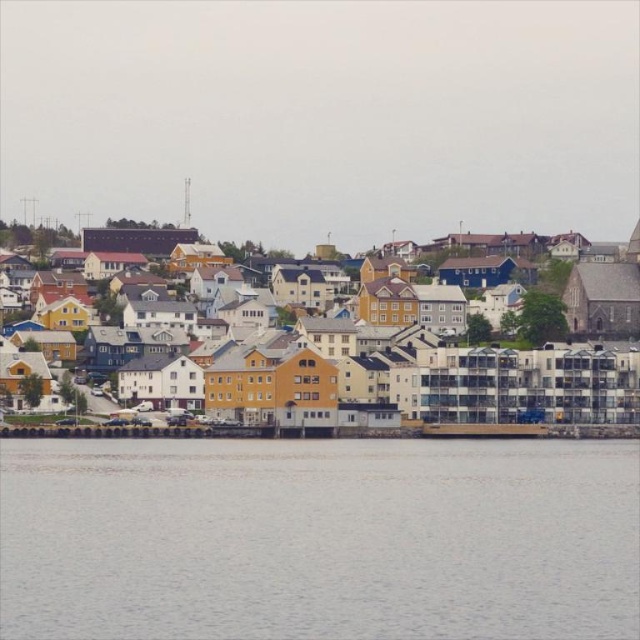
You are a photographer planning to capture the entire coastal town in one shot. Given that the gray water at lower center and the yellow matte building at center are both in your frame, which object occupies more horizontal space in the image?

The yellow matte building at center occupies more horizontal space than the gray water at lower center because the gray water at lower center has a lesser width compared to yellow matte building at center.

You are a photographer planning to capture the coastal town from a boat. You notice the gray water at lower center is at point (317, 538). If you want to focus on the gray water at lower center, where should you position your camera?

The gray water at lower center is located at point (317, 538), so you should position your camera to aim directly at that coordinate to focus on it.